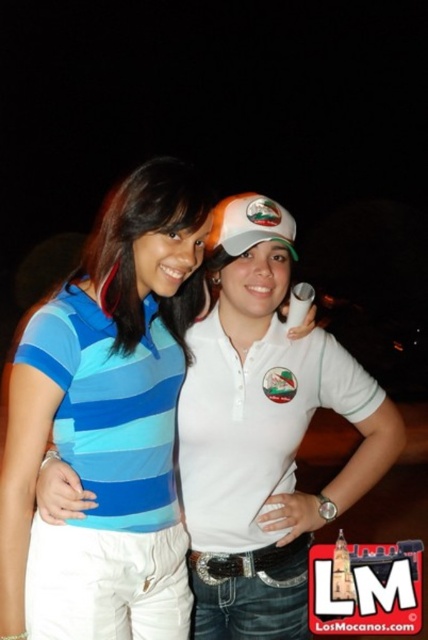
Which is more to the left, blue striped polo shirt at center or blue striped polo shirt at left?

blue striped polo shirt at left

Is point (285, 260) more distant than point (169, 410)?

That is True.

Which is in front, point (265, 436) or point (59, 417)?

Point (59, 417) is in front.

The image size is (428, 640). What are the coordinates of `blue striped polo shirt at center` in the screenshot? It's located at (264, 449).

Is white matte polo shirt at center thinner than blue striped polo shirt at left?

In fact, white matte polo shirt at center might be wider than blue striped polo shirt at left.

Who is more distant from viewer, (235,504) or (59,298)?

Positioned behind is point (235,504).

Describe the element at coordinates (255, 424) in the screenshot. I see `white matte polo shirt at center` at that location.

Where is `white matte polo shirt at center`? This screenshot has width=428, height=640. white matte polo shirt at center is located at coordinates (255, 424).

Is point (59, 298) positioned after point (267, 352)?

No, it is in front of (267, 352).

Identify the location of blue striped shirt at center. (107, 424).